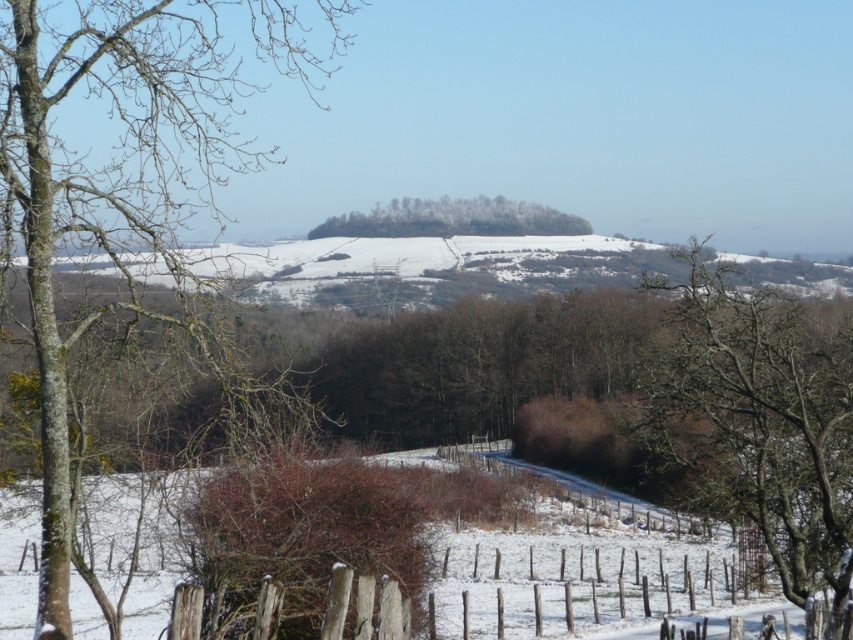
Question: Which of the following is the closest to the observer?

Choices:
 (A) bare branches at center
 (B) snow-covered trees at center

Answer: (A)

Question: Is bare wood tree at left to the left of bare branches at center from the viewer's perspective?

Choices:
 (A) no
 (B) yes

Answer: (B)

Question: Is bare wood tree at left thinner than snow-covered trees at center?

Choices:
 (A) yes
 (B) no

Answer: (A)

Question: Can you confirm if bare wood tree at left is smaller than snow-covered trees at center?

Choices:
 (A) yes
 (B) no

Answer: (B)

Question: Which point is closer to the camera taking this photo?

Choices:
 (A) (416, 216)
 (B) (213, 109)
 (C) (737, 342)

Answer: (C)

Question: Which point is farther from the camera taking this photo?

Choices:
 (A) (352, 230)
 (B) (194, 36)
 (C) (820, 333)

Answer: (A)